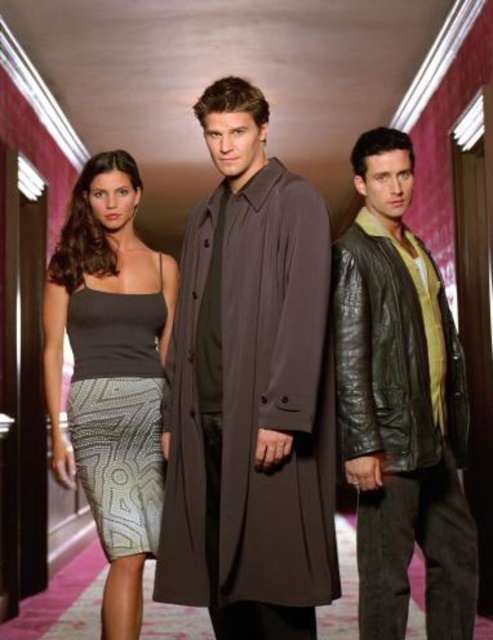
Question: Which point is closer to the camera?

Choices:
 (A) (53, 358)
 (B) (430, 339)

Answer: (B)

Question: Can you confirm if brown smooth coat at center is bigger than leather jacket at center?

Choices:
 (A) yes
 (B) no

Answer: (A)

Question: Is brown smooth coat at center smaller than leather jacket at center?

Choices:
 (A) yes
 (B) no

Answer: (B)

Question: Which object is positioned farthest from the gray textured dress at left?

Choices:
 (A) brown smooth coat at center
 (B) knit fabric tank top at center

Answer: (A)

Question: Which of the following is the closest to the observer?

Choices:
 (A) (332, 419)
 (B) (107, 177)
 (C) (95, 292)

Answer: (A)

Question: Considering the relative positions of brown smooth coat at center and gray textured dress at left in the image provided, where is brown smooth coat at center located with respect to gray textured dress at left?

Choices:
 (A) below
 (B) above

Answer: (B)